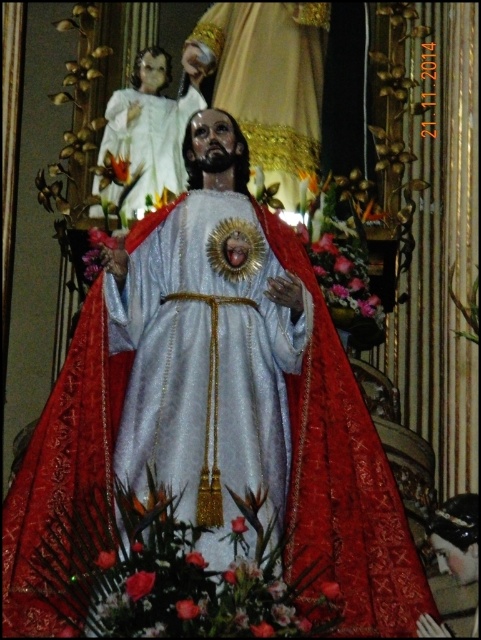
Question: Can you confirm if shiny silver statue at center is wider than white glossy statue at upper left?

Choices:
 (A) no
 (B) yes

Answer: (B)

Question: Does shiny silver statue at center appear under white glossy statue at upper left?

Choices:
 (A) yes
 (B) no

Answer: (A)

Question: Is shiny silver statue at center wider than white glossy statue at upper left?

Choices:
 (A) no
 (B) yes

Answer: (B)